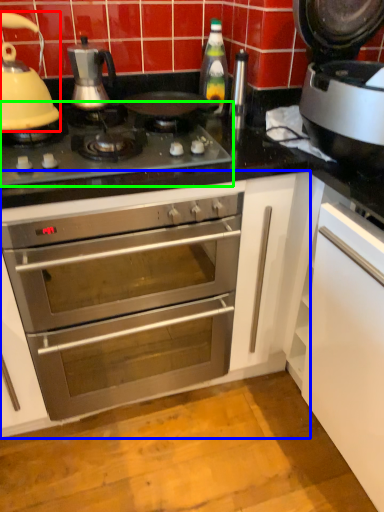
Question: Which is farther away from kitchen appliance (highlighted by a red box)? cabinetry (highlighted by a blue box) or gas stove (highlighted by a green box)?

Choices:
 (A) cabinetry
 (B) gas stove

Answer: (A)